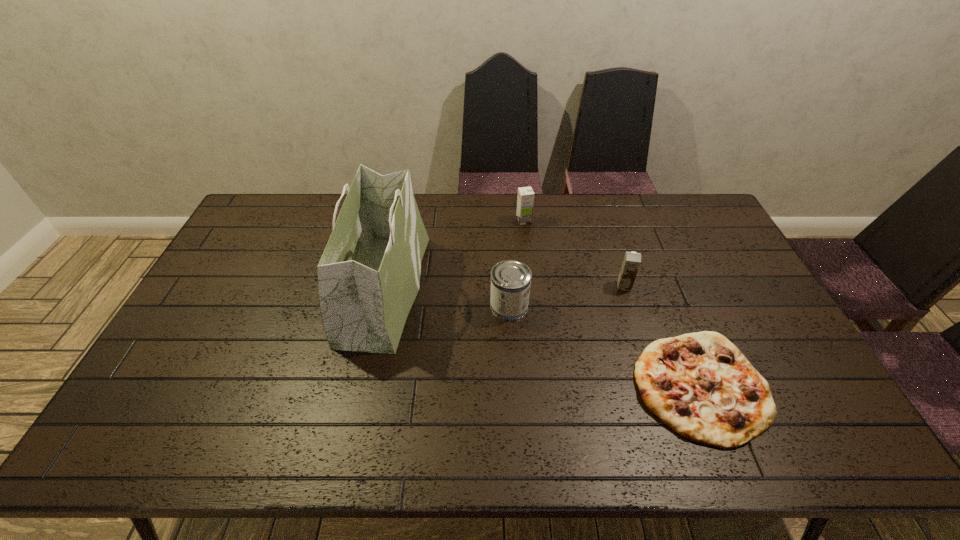
This screenshot has height=540, width=960. I want to click on vacant space at the far left corner of the desktop, so click(263, 222).

Where is `vacant point at the far right corner`? Image resolution: width=960 pixels, height=540 pixels. vacant point at the far right corner is located at coordinates (688, 225).

Locate an element on the screen. free space between the farthest object and the leftmost object is located at coordinates (454, 255).

The width and height of the screenshot is (960, 540). Find the location of `vacant area that lies between the can and the leftmost object`. vacant area that lies between the can and the leftmost object is located at coordinates (447, 297).

You are a GUI agent. You are given a task and a screenshot of the screen. Output one action in this format:
    pyautogui.click(x=<x>, y=<y>)
    Task: Click on the vacant space that is in between the pizza and the nearer chocolate milk
    The width and height of the screenshot is (960, 540).
    Given the screenshot: What is the action you would take?
    pyautogui.click(x=663, y=336)

In order to click on empty space between the can and the pizza in this screenshot , I will do `click(606, 346)`.

Identify the location of vacant space that's between the leftmost object and the can. 447,297.

Where is `vacant region between the left chocolate milk and the right chocolate milk`? The image size is (960, 540). vacant region between the left chocolate milk and the right chocolate milk is located at coordinates (574, 253).

Identify the location of free spot between the can and the shortest object. (606, 346).

Find the location of `vacant region between the pizza and the nearer chocolate milk`. vacant region between the pizza and the nearer chocolate milk is located at coordinates (663, 336).